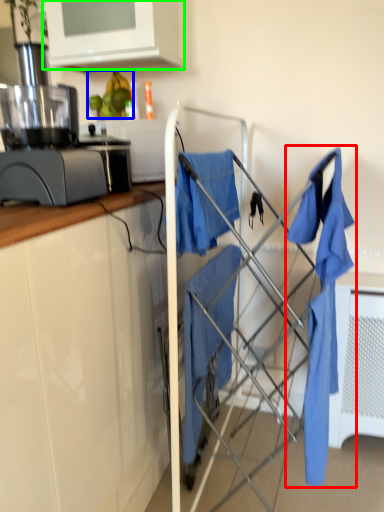
Question: Which object is positioned closest to laundry (highlighted by a red box)? Select from fruit (highlighted by a blue box) and cabinetry (highlighted by a green box).

Choices:
 (A) fruit
 (B) cabinetry

Answer: (A)